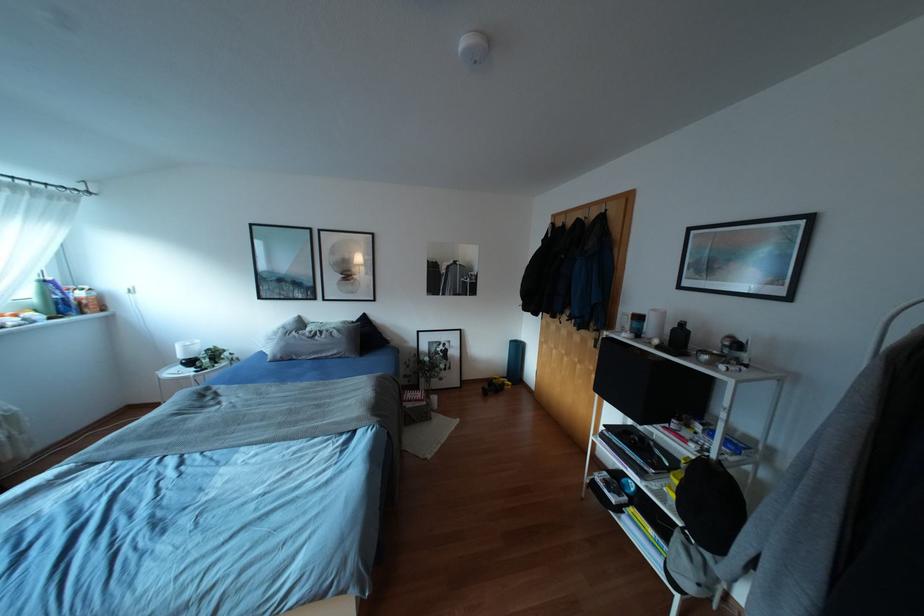
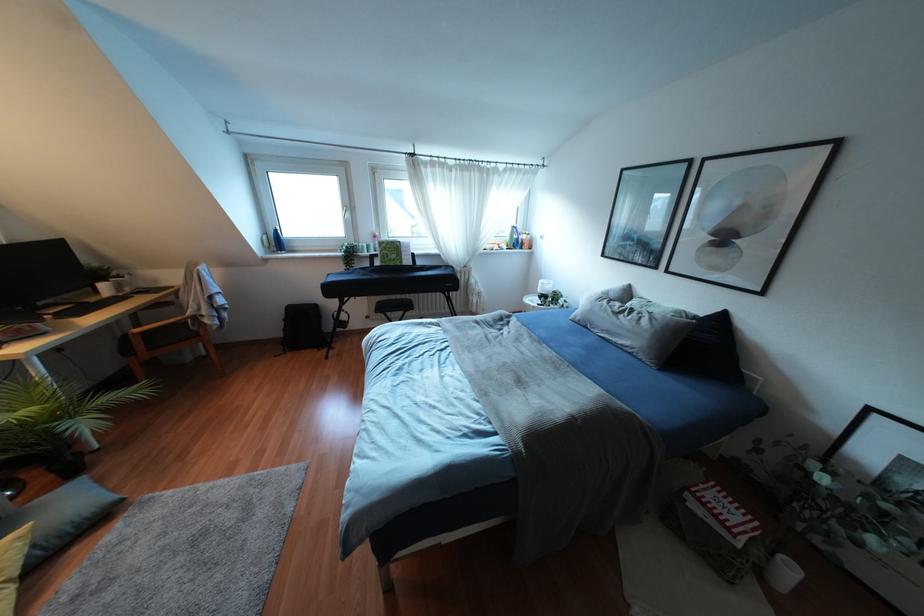
In the second image, find the point that corresponds to point 363,317 in the first image.

(722, 317)